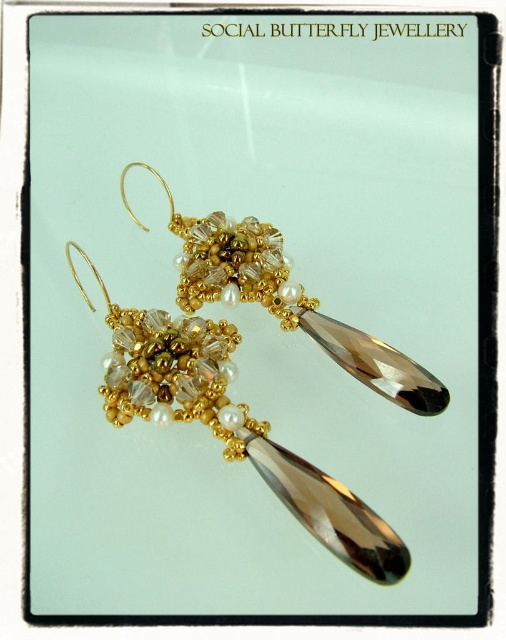
Question: Which point appears closest to the camera in this image?

Choices:
 (A) (118, 336)
 (B) (121, 189)

Answer: (A)

Question: Is smoky quartz teardrop at center closer to the viewer compared to gold beaded cluster at center?

Choices:
 (A) no
 (B) yes

Answer: (B)

Question: Among these points, which one is farthest from the camera?

Choices:
 (A) (327, 477)
 (B) (302, 296)

Answer: (B)

Question: Does smoky quartz teardrop at center appear under gold beaded cluster at center?

Choices:
 (A) no
 (B) yes

Answer: (B)

Question: Is smoky quartz teardrop at center above gold beaded cluster at center?

Choices:
 (A) no
 (B) yes

Answer: (A)